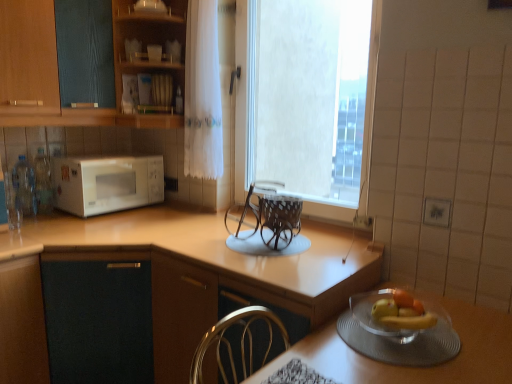
Find the location of a particular element. This screenshot has height=384, width=512. vacant area that is in front of white matte microwave at left is located at coordinates (92, 226).